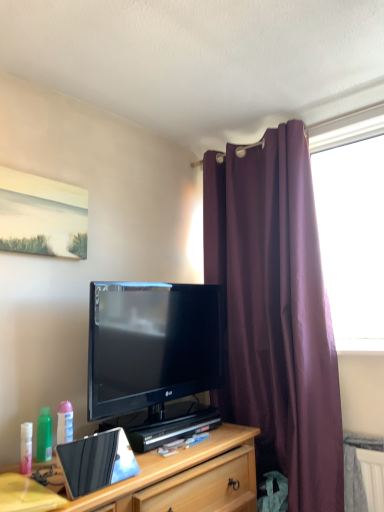
Question: Is the position of yellow matte desk at lower left less distant than that of purple fabric curtain at right?

Choices:
 (A) no
 (B) yes

Answer: (B)

Question: Is yellow matte desk at lower left oriented towards purple fabric curtain at right?

Choices:
 (A) yes
 (B) no

Answer: (B)

Question: Is yellow matte desk at lower left shorter than purple fabric curtain at right?

Choices:
 (A) no
 (B) yes

Answer: (B)

Question: Is yellow matte desk at lower left to the right of purple fabric curtain at right from the viewer's perspective?

Choices:
 (A) yes
 (B) no

Answer: (B)

Question: Is yellow matte desk at lower left positioned with its back to purple fabric curtain at right?

Choices:
 (A) yes
 (B) no

Answer: (B)

Question: Considering their positions, is purple fabric curtain at right located in front of or behind green matte spray bottle at lower left?

Choices:
 (A) behind
 (B) front

Answer: (A)

Question: Is purple fabric curtain at right wider or thinner than green matte spray bottle at lower left?

Choices:
 (A) wide
 (B) thin

Answer: (A)

Question: Is purple fabric curtain at right situated inside green matte spray bottle at lower left or outside?

Choices:
 (A) inside
 (B) outside

Answer: (B)

Question: Does point (228, 177) appear closer or farther from the camera than point (41, 460)?

Choices:
 (A) farther
 (B) closer

Answer: (A)

Question: From a real-world perspective, relative to wooden cabinet at lower center, is yellow matte desk at lower left vertically above or below?

Choices:
 (A) above
 (B) below

Answer: (A)

Question: Based on their sizes in the image, would you say yellow matte desk at lower left is bigger or smaller than wooden cabinet at lower center?

Choices:
 (A) big
 (B) small

Answer: (B)

Question: Choose the correct answer: Is yellow matte desk at lower left inside wooden cabinet at lower center or outside it?

Choices:
 (A) inside
 (B) outside

Answer: (B)

Question: From the image's perspective, is yellow matte desk at lower left located above or below wooden cabinet at lower center?

Choices:
 (A) below
 (B) above

Answer: (B)

Question: Based on their sizes in the image, would you say black glossy tv at center is bigger or smaller than wooden cabinet at lower center?

Choices:
 (A) small
 (B) big

Answer: (A)

Question: From a real-world perspective, is black glossy tv at center physically located above or below wooden cabinet at lower center?

Choices:
 (A) above
 (B) below

Answer: (A)